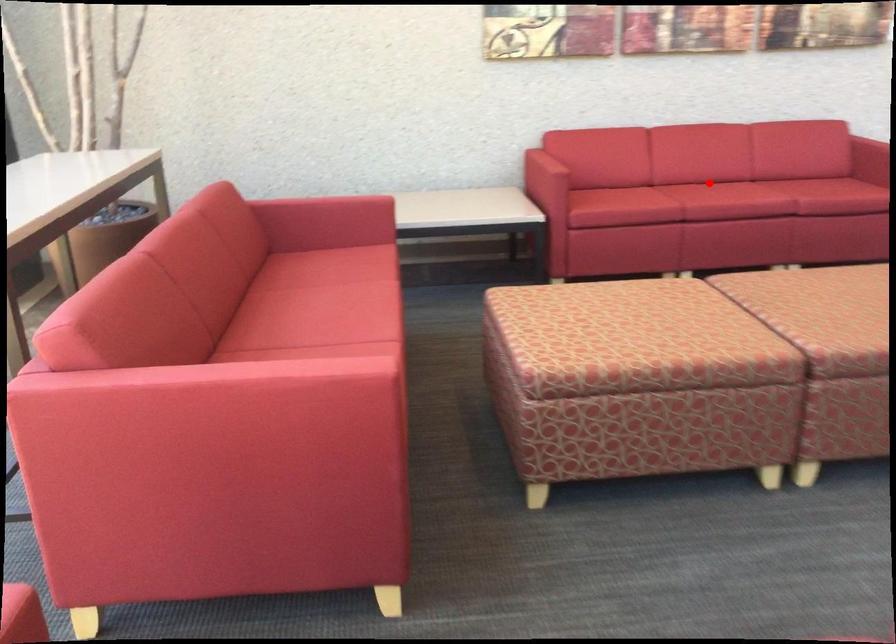
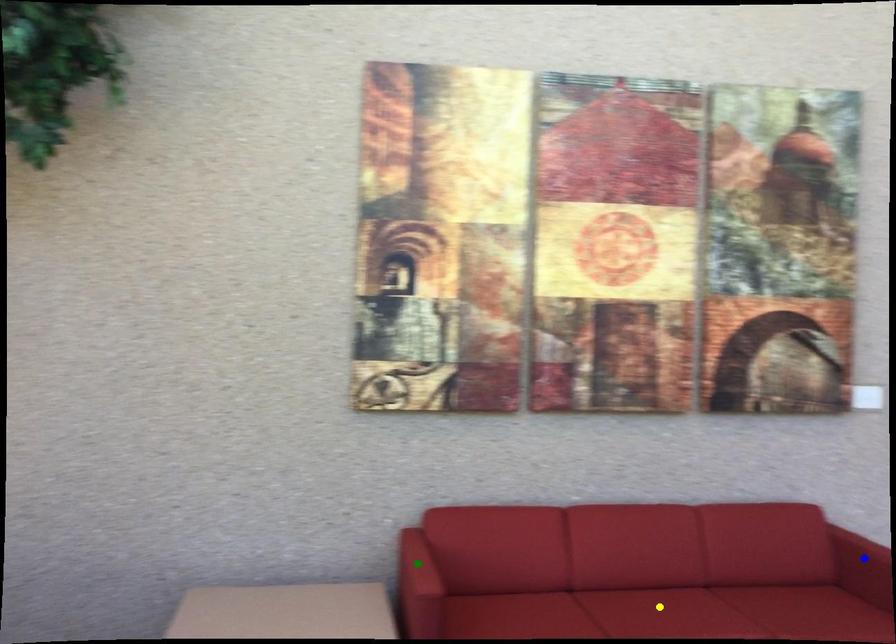
Question: I am providing you with two images of the same scene from different viewpoints. A red point is marked on the first image. You are given multiple points on the second image. Which point in image 2 is actually the same real-world point as the red point in image 1?

Choices:
 (A) blue point
 (B) yellow point
 (C) green point

Answer: (B)